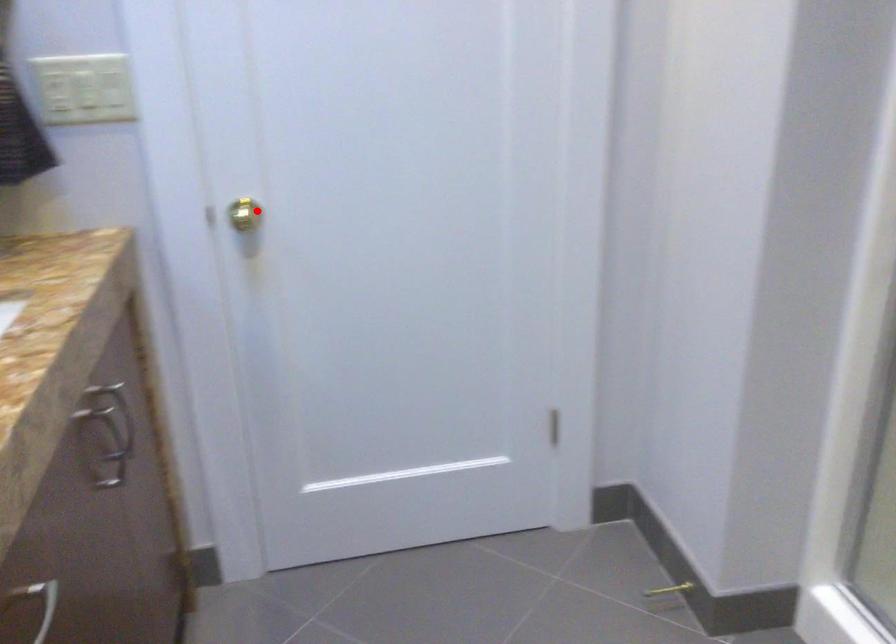
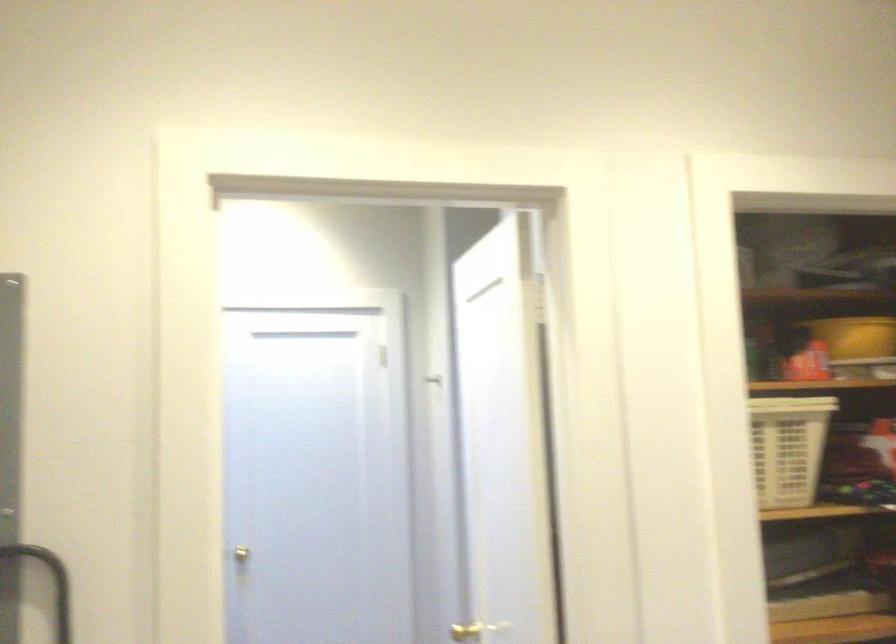
Find the pixel in the second image that matches the highlighted location in the first image.

(253, 553)